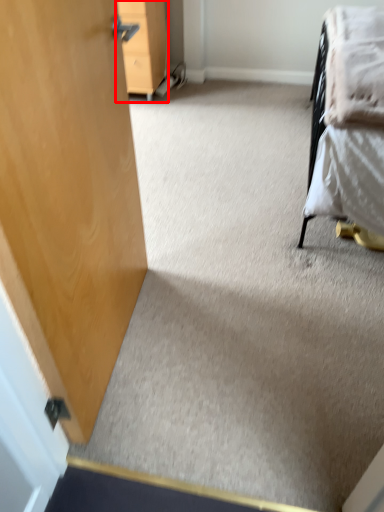
Question: From the image's perspective, considering the relative positions of furniture (annotated by the red box) and blanket in the image provided, where is furniture (annotated by the red box) located with respect to the staircase?

Choices:
 (A) below
 (B) above

Answer: (B)